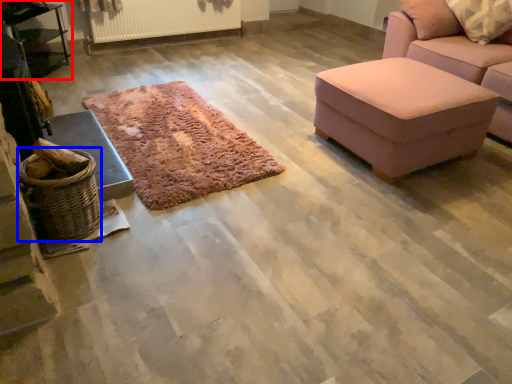
Question: Which of the following is the farthest to the observer, table (highlighted by a red box) or basket (highlighted by a blue box)?

Choices:
 (A) table
 (B) basket

Answer: (A)